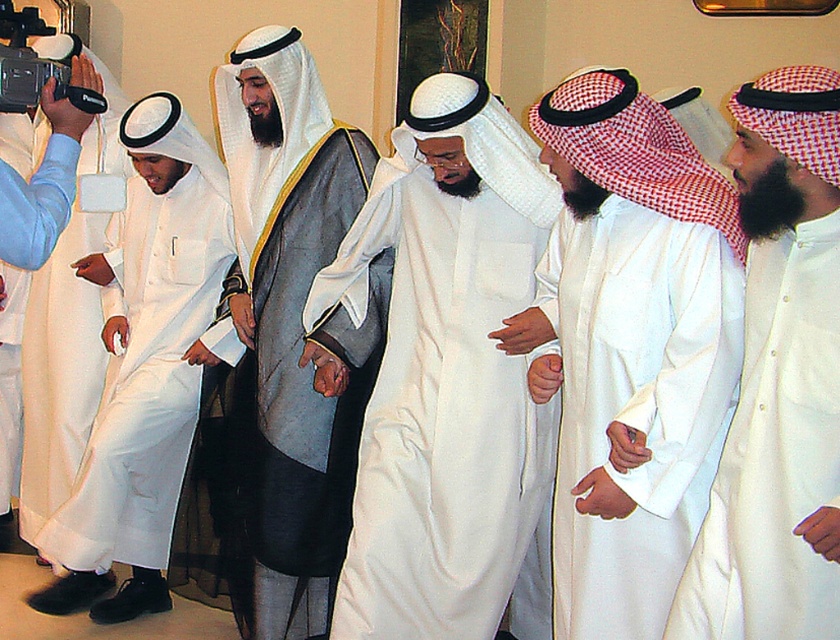
Can you confirm if matte gray robe at center is taller than white matte robe at left?

Correct, matte gray robe at center is much taller as white matte robe at left.

Between point (308, 516) and point (218, 209), which one is positioned behind?

Positioned behind is point (218, 209).

Is point (315, 417) behind point (42, 536)?

No, (315, 417) is in front of (42, 536).

You are a GUI agent. You are given a task and a screenshot of the screen. Output one action in this format:
    pyautogui.click(x=<x>, y=<y>)
    Task: Click on the matte gray robe at center
    
    Given the screenshot: What is the action you would take?
    pyautogui.click(x=291, y=332)

The height and width of the screenshot is (640, 840). Describe the element at coordinates (634, 404) in the screenshot. I see `white satin robe at center` at that location.

Can you confirm if white satin robe at center is positioned to the left of matte white camera at left?

Incorrect, white satin robe at center is not on the left side of matte white camera at left.

Describe the element at coordinates (634, 404) in the screenshot. Image resolution: width=840 pixels, height=640 pixels. I see `white satin robe at center` at that location.

This screenshot has height=640, width=840. Identify the location of white satin robe at center. (634, 404).

In the scene shown: Does white matte kandura at center have a larger size compared to white matte robe at left?

Actually, white matte kandura at center might be smaller than white matte robe at left.

In the scene shown: Does white matte kandura at center have a smaller size compared to white matte robe at left?

Correct, white matte kandura at center occupies less space than white matte robe at left.

Locate an element on the screen. The height and width of the screenshot is (640, 840). white matte kandura at center is located at coordinates (778, 381).

The image size is (840, 640). What are the coordinates of `white matte kandura at center` in the screenshot? It's located at (778, 381).